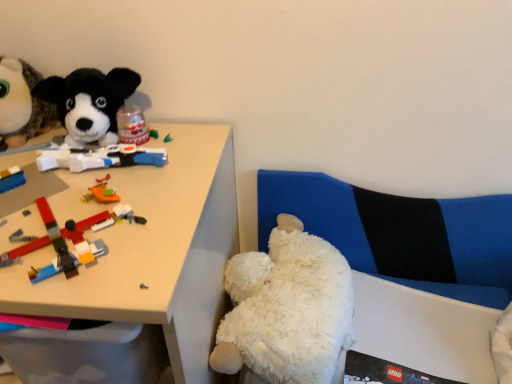
The height and width of the screenshot is (384, 512). I want to click on white plastic desk at upper left, so click(150, 249).

This screenshot has height=384, width=512. Identify the location of white fluffy teddy bear at lower right, the third toy viewed from the left. (287, 309).

Locate an element on the screen. The width and height of the screenshot is (512, 384). black plush dog at upper left, acting as the 3th toy starting from the right is located at coordinates (21, 104).

I want to click on white plastic desk at upper left, so click(150, 249).

Can you confirm if white plush couch at lower right is thinner than white plastic desk at upper left?

Correct, the width of white plush couch at lower right is less than that of white plastic desk at upper left.

In the scene shown: From a real-world perspective, who is located higher, white plush couch at lower right or white plastic desk at upper left?

white plush couch at lower right.

Considering the sizes of objects white plush couch at lower right and white plastic desk at upper left in the image provided, who is bigger, white plush couch at lower right or white plastic desk at upper left?

white plastic desk at upper left.

I want to click on desk on the right of black plush dog at upper left, acting as the 3th toy starting from the right, so click(150, 249).

Based on the photo, visually, is white plastic desk at upper left positioned to the left or to the right of black plush dog at upper left, the 1th toy viewed from the top?

white plastic desk at upper left is positioned on black plush dog at upper left, the 1th toy viewed from the top,'s right side.

Between point (109, 313) and point (42, 123), which one is positioned in front?

Positioned in front is point (109, 313).

From a real-world perspective, is white plush couch at lower right above or below brick-like plastic toys at left, placed as the 2th toy when sorted from bottom to top?

white plush couch at lower right is below brick-like plastic toys at left, placed as the 2th toy when sorted from bottom to top.

How many degrees apart are the facing directions of white plush couch at lower right and brick-like plastic toys at left, placed as the second toy when sorted from left to right?

They differ by 2.45 degrees in their facing directions.

Between white plush couch at lower right and brick-like plastic toys at left, placed as the 2th toy when sorted from bottom to top, which one has smaller width?

white plush couch at lower right is thinner.

Based on the photo, from the image's perspective, between white plush couch at lower right and brick-like plastic toys at left, which is the second toy from right to left, who is located below?

From the image's view, white plush couch at lower right is below.

Between white plastic desk at upper left and white plush couch at lower right, which one has larger width?

With larger width is white plastic desk at upper left.

In the image, is white plastic desk at upper left positioned in front of or behind white plush couch at lower right?

Visually, white plastic desk at upper left is located in front of white plush couch at lower right.

Is white plastic desk at upper left beside white plush couch at lower right?

No, white plastic desk at upper left is not touching white plush couch at lower right.

Where is `desk lying on the left of white plush couch at lower right`? Image resolution: width=512 pixels, height=384 pixels. desk lying on the left of white plush couch at lower right is located at coordinates (150, 249).

Considering the sizes of objects black plush dog at upper left, positioned as the 3th toy in bottom-to-top order, and white fluffy teddy bear at lower right, acting as the 3th toy starting from the top, in the image provided, who is wider, black plush dog at upper left, positioned as the 3th toy in bottom-to-top order, or white fluffy teddy bear at lower right, acting as the 3th toy starting from the top,?

Wider between the two is white fluffy teddy bear at lower right, acting as the 3th toy starting from the top.

From a real-world perspective, which is physically above, black plush dog at upper left, the 1th toy positioned from the left, or white fluffy teddy bear at lower right, the third toy viewed from the left?

black plush dog at upper left, the 1th toy positioned from the left, from a real-world perspective.

Can you confirm if black plush dog at upper left, the 1th toy viewed from the top, is taller than white fluffy teddy bear at lower right, which ranks as the first toy in bottom-to-top order?

Incorrect, the height of black plush dog at upper left, the 1th toy viewed from the top, is not larger of that of white fluffy teddy bear at lower right, which ranks as the first toy in bottom-to-top order.

Is white fluffy teddy bear at lower right, acting as the 3th toy starting from the top, shorter than white plush couch at lower right?

Yes, white fluffy teddy bear at lower right, acting as the 3th toy starting from the top, is shorter than white plush couch at lower right.

Can you confirm if white fluffy teddy bear at lower right, which is counted as the first toy, starting from the right, is thinner than white plush couch at lower right?

Incorrect, the width of white fluffy teddy bear at lower right, which is counted as the first toy, starting from the right, is not less than that of white plush couch at lower right.

How much distance is there between white fluffy teddy bear at lower right, which ranks as the first toy in bottom-to-top order, and white plush couch at lower right?

white fluffy teddy bear at lower right, which ranks as the first toy in bottom-to-top order, is 7.56 inches from white plush couch at lower right.

Is point (345, 329) farther from viewer compared to point (466, 355)?

No, it is not.

Considering the relative positions of white plastic desk at upper left and brick-like plastic toys at left, placed as the second toy when sorted from left to right, in the image provided, is white plastic desk at upper left to the left of brick-like plastic toys at left, placed as the second toy when sorted from left to right, from the viewer's perspective?

Yes.

Is white plastic desk at upper left spatially inside brick-like plastic toys at left, which is the 2th toy from top to bottom, or outside of it?

white plastic desk at upper left exists outside the volume of brick-like plastic toys at left, which is the 2th toy from top to bottom.

Is white plastic desk at upper left wider than brick-like plastic toys at left, placed as the second toy when sorted from left to right?

Yes.

Is white plastic desk at upper left positioned with its back to brick-like plastic toys at left, placed as the second toy when sorted from left to right?

white plastic desk at upper left does not have its back to brick-like plastic toys at left, placed as the second toy when sorted from left to right.

Find the location of a particular element. This screenshot has width=512, height=384. couch that is on the right side of white plastic desk at upper left is located at coordinates (408, 265).

From a real-world perspective, starting from the white plastic desk at upper left, which toy is the 3rd one vertically above it? Please provide its 2D coordinates.

[(21, 104)]

Based on their spatial positions, is white plastic desk at upper left or white fluffy teddy bear at lower right, the third toy viewed from the left, further from black plush dog at upper left, the 1th toy positioned from the left?

white fluffy teddy bear at lower right, the third toy viewed from the left, lies further to black plush dog at upper left, the 1th toy positioned from the left, than the other object.

Estimate the real-world distances between objects in this image. Which object is closer to white plush couch at lower right, white fluffy teddy bear at lower right, which ranks as the first toy in bottom-to-top order, or white plastic desk at upper left?

white fluffy teddy bear at lower right, which ranks as the first toy in bottom-to-top order, is closer to white plush couch at lower right.

Considering their positions, is white plush couch at lower right positioned further to white fluffy teddy bear at lower right, which is counted as the first toy, starting from the right, than white plastic desk at upper left?

white plastic desk at upper left is further to white fluffy teddy bear at lower right, which is counted as the first toy, starting from the right.

Which object lies further to the anchor point white plastic desk at upper left, black plush dog at upper left, the 1th toy positioned from the left, or brick-like plastic toys at left, placed as the 2th toy when sorted from bottom to top?

Among the two, black plush dog at upper left, the 1th toy positioned from the left, is located further to white plastic desk at upper left.

Looking at the image, which one is located closer to brick-like plastic toys at left, placed as the second toy when sorted from left to right, white plastic desk at upper left or white fluffy teddy bear at lower right, which ranks as the first toy in bottom-to-top order?

white plastic desk at upper left lies closer to brick-like plastic toys at left, placed as the second toy when sorted from left to right, than the other object.

Estimate the real-world distances between objects in this image. Which object is closer to white plastic desk at upper left, black plush dog at upper left, positioned as the 3th toy in bottom-to-top order, or white plush couch at lower right?

Among the two, black plush dog at upper left, positioned as the 3th toy in bottom-to-top order, is located nearer to white plastic desk at upper left.

Estimate the real-world distances between objects in this image. Which object is closer to white fluffy teddy bear at lower right, acting as the 3th toy starting from the top, brick-like plastic toys at left, which is the 2th toy from top to bottom, or white plush couch at lower right?

The object closer to white fluffy teddy bear at lower right, acting as the 3th toy starting from the top, is white plush couch at lower right.

In the scene shown: Estimate the real-world distances between objects in this image. Which object is further from white fluffy teddy bear at lower right, which ranks as the first toy in bottom-to-top order, black plush dog at upper left, the 1th toy viewed from the top, or white plush couch at lower right?

black plush dog at upper left, the 1th toy viewed from the top, is further to white fluffy teddy bear at lower right, which ranks as the first toy in bottom-to-top order.

At what (x,y) coordinates should I click in order to perform the action: click on toy between white plastic desk at upper left and white fluffy teddy bear at lower right, acting as the 3th toy starting from the top, in the horizontal direction. Please return your answer as a coordinate pair (x, y). This screenshot has width=512, height=384. Looking at the image, I should click on (71, 240).

Where is `desk located between black plush dog at upper left, positioned as the 3th toy in bottom-to-top order, and white fluffy teddy bear at lower right, the third toy viewed from the left, in the left-right direction`? desk located between black plush dog at upper left, positioned as the 3th toy in bottom-to-top order, and white fluffy teddy bear at lower right, the third toy viewed from the left, in the left-right direction is located at coordinates (150, 249).

Where is `toy between black plush dog at upper left, the 1th toy viewed from the top, and white fluffy teddy bear at lower right, the third toy viewed from the left, from left to right`? toy between black plush dog at upper left, the 1th toy viewed from the top, and white fluffy teddy bear at lower right, the third toy viewed from the left, from left to right is located at coordinates (71, 240).

Find the location of `desk between black plush dog at upper left, acting as the 3th toy starting from the right, and white plush couch at lower right`. desk between black plush dog at upper left, acting as the 3th toy starting from the right, and white plush couch at lower right is located at coordinates (150, 249).